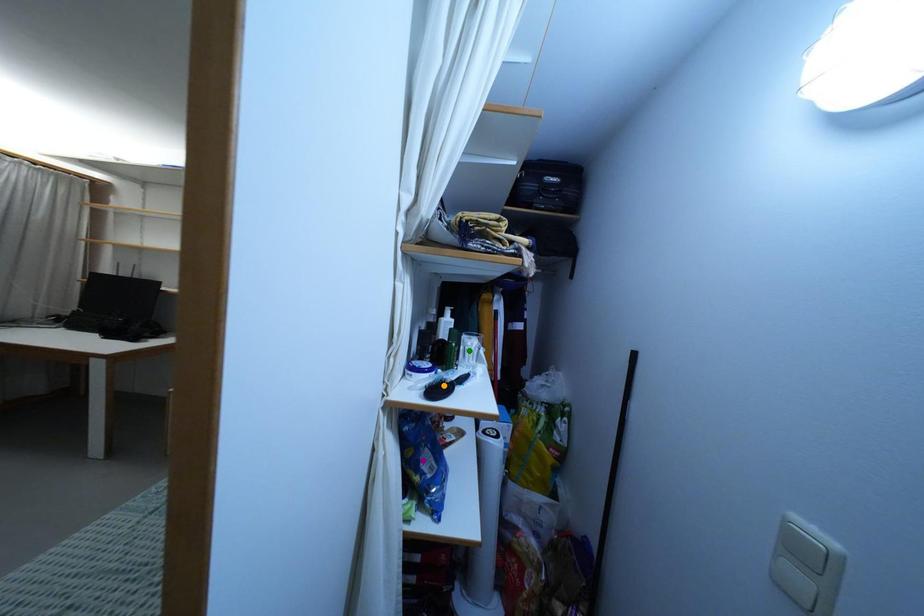
Order these from nearest to farthest:
- purple point
- green point
- orange point

orange point
purple point
green point